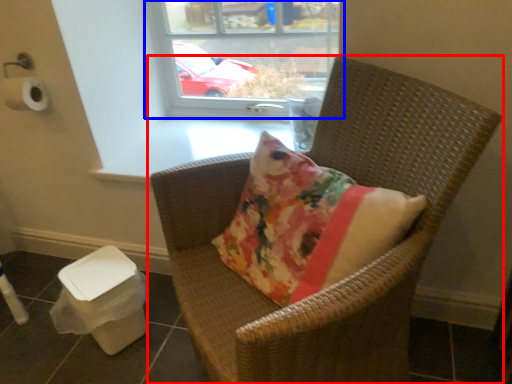
Question: Which point is closer to the camera, chair (highlighted by a red box) or window (highlighted by a blue box)?

Choices:
 (A) chair
 (B) window

Answer: (A)